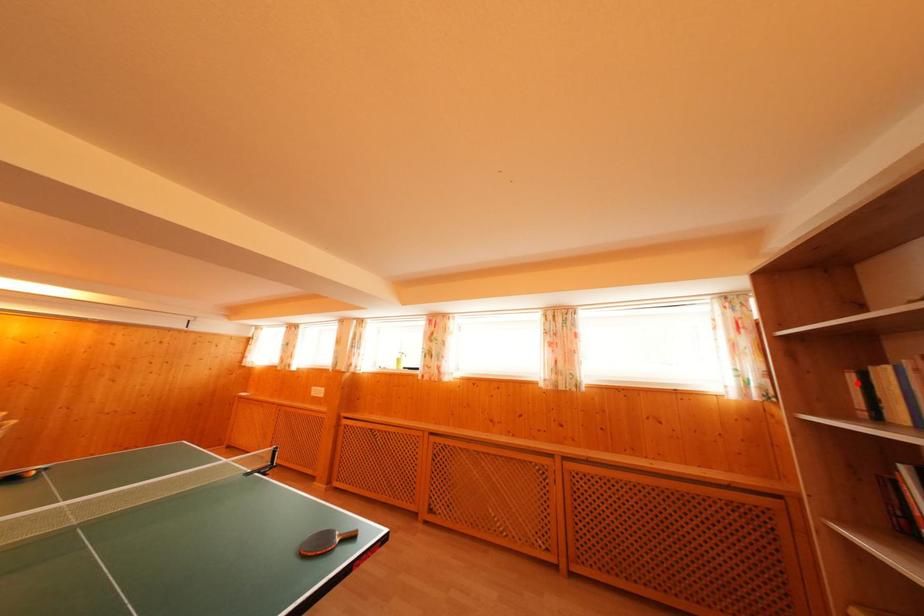
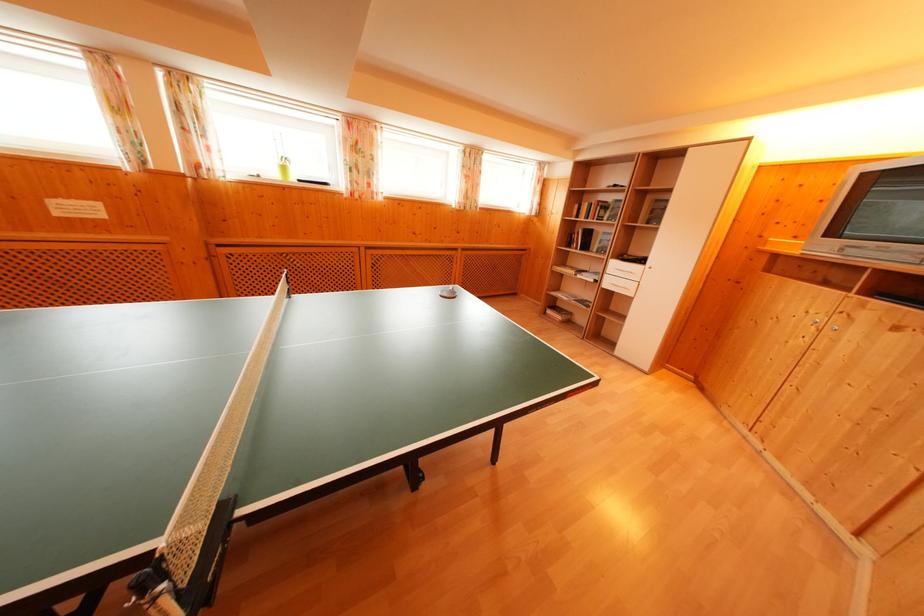
The point at the highlighted location is marked in the first image. Where is the corresponding point in the second image?

(581, 211)